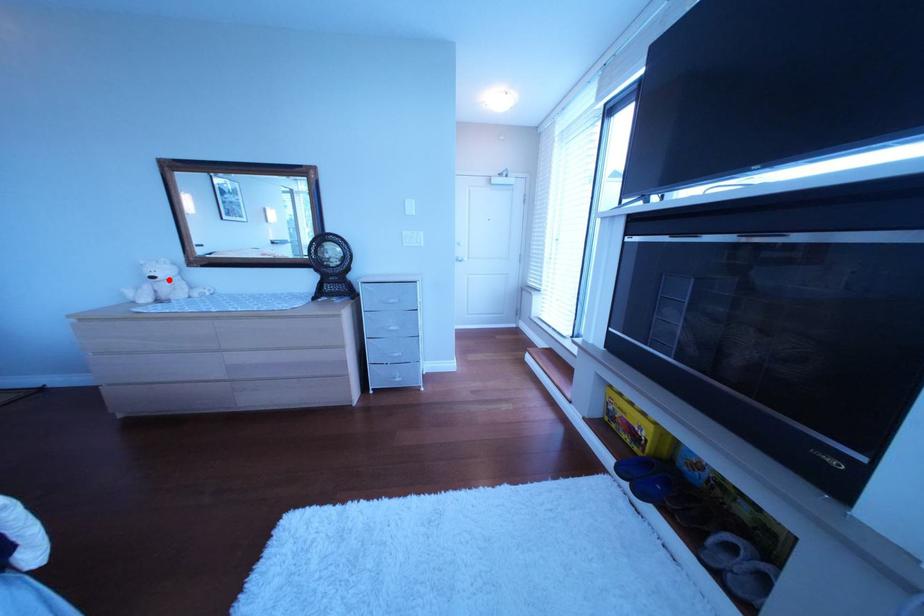
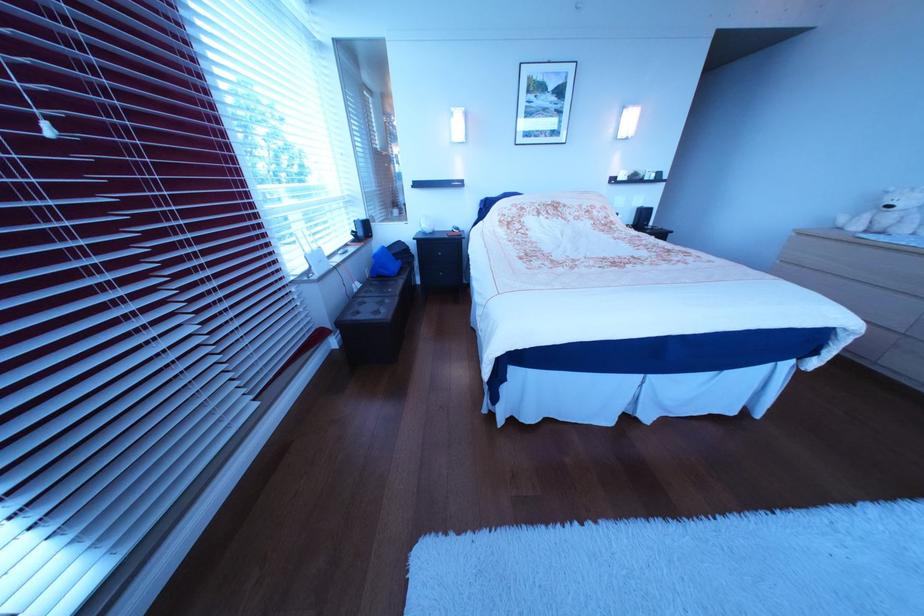
Find the pixel in the second image that matches the highlighted location in the first image.

(906, 209)